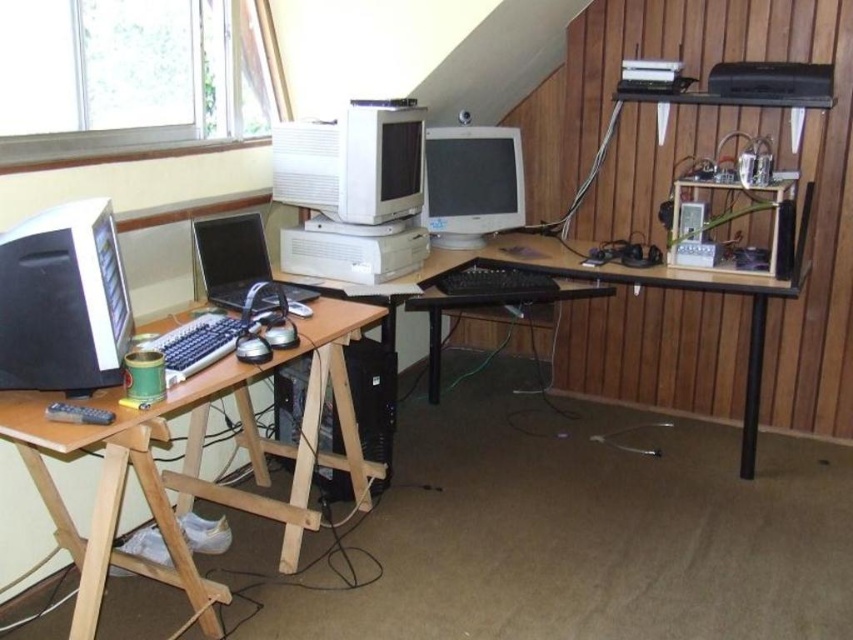
Is point (506, 168) behind point (814, 70)?

That is True.

At what (x,y) coordinates should I click in order to perform the action: click on matte gray monitor at center. Please return your answer as a coordinate pair (x, y). Looking at the image, I should click on (471, 182).

Is light brown wood table at left bigger than matte gray monitor at center?

Indeed, light brown wood table at left has a larger size compared to matte gray monitor at center.

Who is more forward, (287, 552) or (463, 141)?

Point (287, 552)

Find the location of `light brown wood table at left`. light brown wood table at left is located at coordinates (193, 464).

Is white plastic desktop computer at center further to camera compared to matte gray monitor at center?

That is False.

Can you confirm if white plastic desktop computer at center is positioned to the right of matte gray monitor at center?

Incorrect, white plastic desktop computer at center is not on the right side of matte gray monitor at center.

Describe the element at coordinates (352, 163) in the screenshot. I see `white plastic desktop computer at center` at that location.

Find the location of a particular element. This screenshot has height=640, width=853. white plastic desktop computer at center is located at coordinates (352, 163).